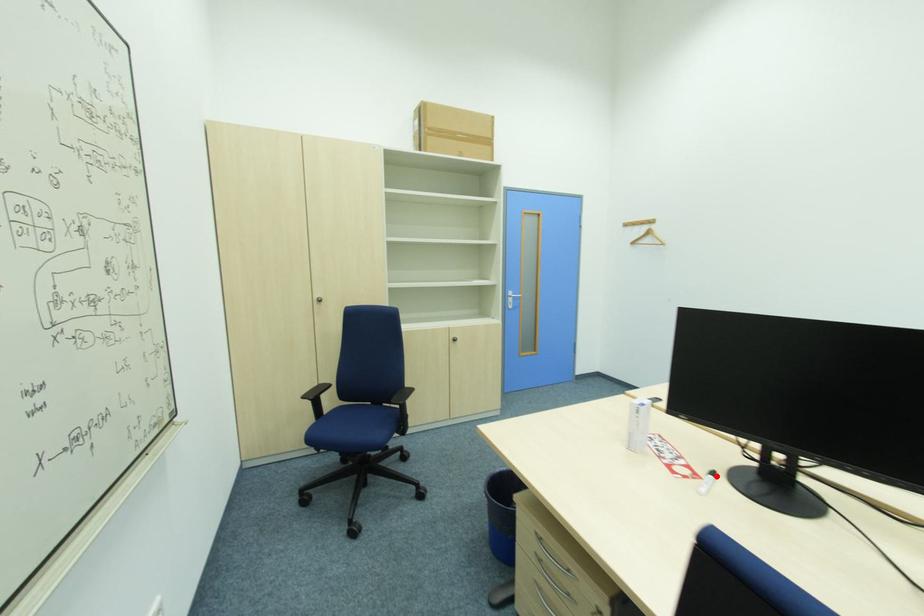
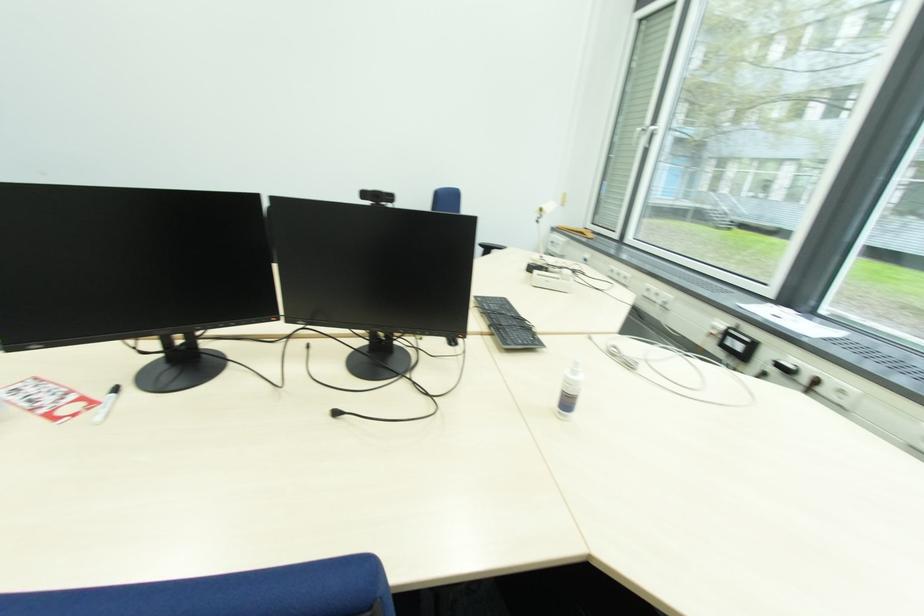
Where in the second image is the point corresponding to the highlighted location from the first image?

(118, 392)